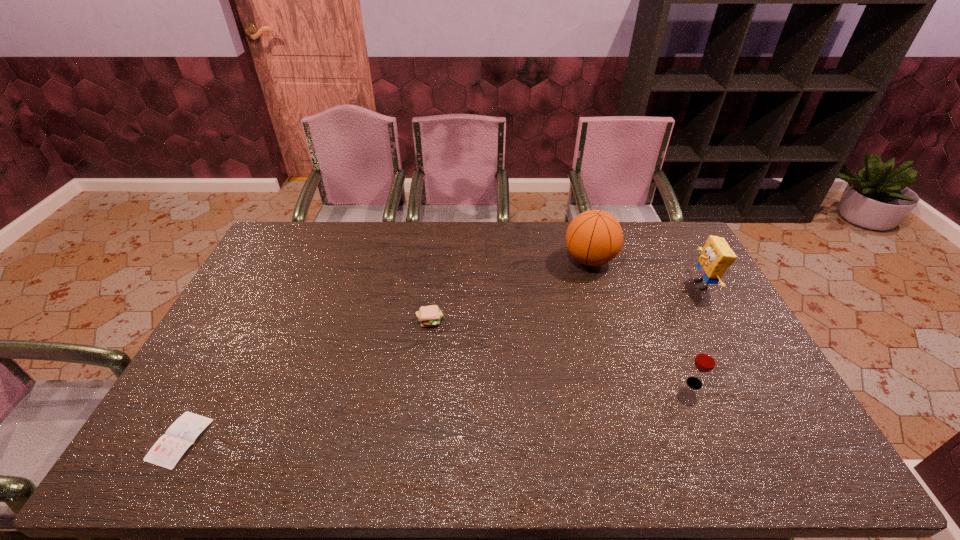
Identify the location of free space between the diary and the second nearest object. (437, 411).

At what (x,y) coordinates should I click in order to perform the action: click on vacant space in between the fourth tallest object and the fourth shortest object. Please return your answer as a coordinate pair (x, y). The image size is (960, 540). Looking at the image, I should click on (565, 302).

This screenshot has height=540, width=960. What are the coordinates of `vacant area that lies between the nearest object and the sponge` in the screenshot? It's located at (441, 362).

Locate an element on the screen. This screenshot has height=540, width=960. free spot between the patty and the sponge is located at coordinates (565, 302).

This screenshot has height=540, width=960. I want to click on free space between the basketball and the rightmost object, so click(x=646, y=273).

Image resolution: width=960 pixels, height=540 pixels. What are the coordinates of `free space between the third shortest object and the fourth shortest object` in the screenshot? It's located at (698, 334).

This screenshot has height=540, width=960. I want to click on vacant area that lies between the rightmost object and the third farthest object, so click(x=565, y=302).

The image size is (960, 540). Find the location of `the fourth closest object relative to the basketball`. the fourth closest object relative to the basketball is located at coordinates (166, 452).

The width and height of the screenshot is (960, 540). I want to click on the fourth closest object to the second object from right to left, so click(166, 452).

Identify the location of vacant space that satisfies the following two spatial constraints: 1. on the face of the second tallest object; 2. on the front side of the patty. The image size is (960, 540). click(x=722, y=320).